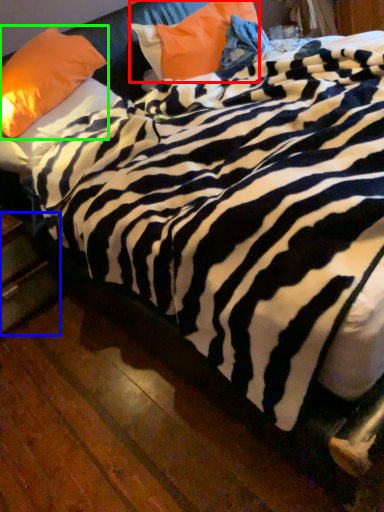
Question: Considering the real-world distances, which object is farthest from pillow (highlighted by a red box)? drawer (highlighted by a blue box) or pillow (highlighted by a green box)?

Choices:
 (A) drawer
 (B) pillow

Answer: (A)